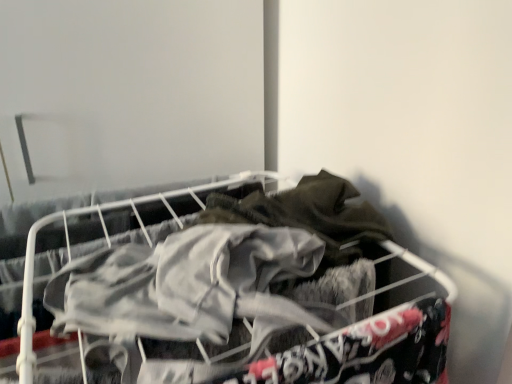
Image resolution: width=512 pixels, height=384 pixels. What do you see at coordinates (108, 245) in the screenshot?
I see `white plastic laundry basket at center` at bounding box center [108, 245].

What is the approximate height of white plastic laundry basket at center?

white plastic laundry basket at center is 11.54 inches tall.

Identify the location of white plastic laundry basket at center. Image resolution: width=512 pixels, height=384 pixels. (108, 245).

Locate an element on the screen. Image resolution: width=512 pixels, height=384 pixels. white plastic laundry basket at center is located at coordinates (108, 245).